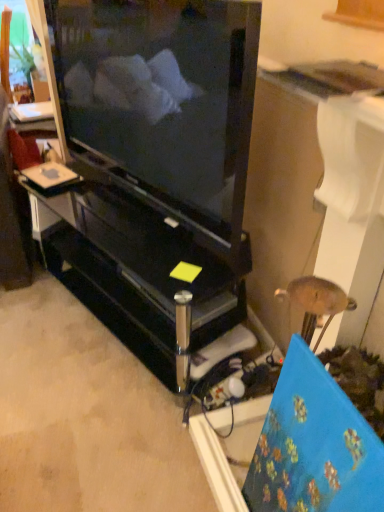
Question: Does black glossy television at center have a lesser height compared to black glossy entertainment center at center?

Choices:
 (A) no
 (B) yes

Answer: (A)

Question: Is black glossy television at center facing away from black glossy entertainment center at center?

Choices:
 (A) no
 (B) yes

Answer: (A)

Question: Is black glossy television at center taller than black glossy entertainment center at center?

Choices:
 (A) yes
 (B) no

Answer: (A)

Question: Is black glossy television at center aimed at black glossy entertainment center at center?

Choices:
 (A) yes
 (B) no

Answer: (B)

Question: From a real-world perspective, is black glossy television at center located higher than black glossy entertainment center at center?

Choices:
 (A) yes
 (B) no

Answer: (A)

Question: Is black glossy television at center not inside black glossy entertainment center at center?

Choices:
 (A) no
 (B) yes

Answer: (B)

Question: Does black glossy entertainment center at center have a smaller size compared to black glossy television at center?

Choices:
 (A) yes
 (B) no

Answer: (B)

Question: Considering the relative positions of black glossy entertainment center at center and black glossy television at center in the image provided, is black glossy entertainment center at center behind black glossy television at center?

Choices:
 (A) yes
 (B) no

Answer: (A)

Question: Can you confirm if black glossy entertainment center at center is positioned to the left of black glossy television at center?

Choices:
 (A) yes
 (B) no

Answer: (A)

Question: From a real-world perspective, is black glossy entertainment center at center located beneath black glossy television at center?

Choices:
 (A) yes
 (B) no

Answer: (A)

Question: Considering the relative positions of black glossy entertainment center at center and black glossy television at center in the image provided, is black glossy entertainment center at center in front of black glossy television at center?

Choices:
 (A) no
 (B) yes

Answer: (A)

Question: Can black glossy television at center be found inside black glossy entertainment center at center?

Choices:
 (A) yes
 (B) no

Answer: (B)

Question: Is black glossy television at center inside the boundaries of black glossy entertainment center at center, or outside?

Choices:
 (A) outside
 (B) inside

Answer: (A)